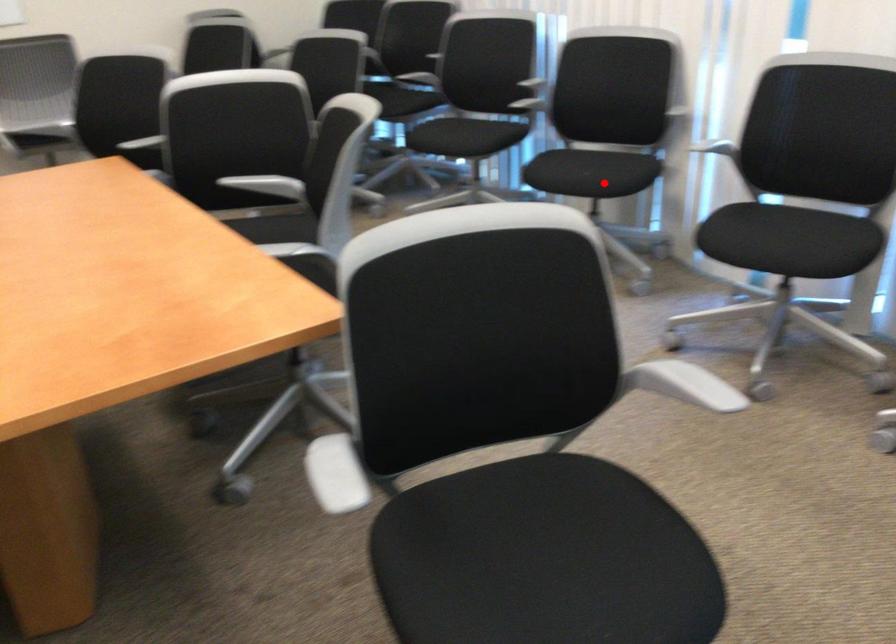
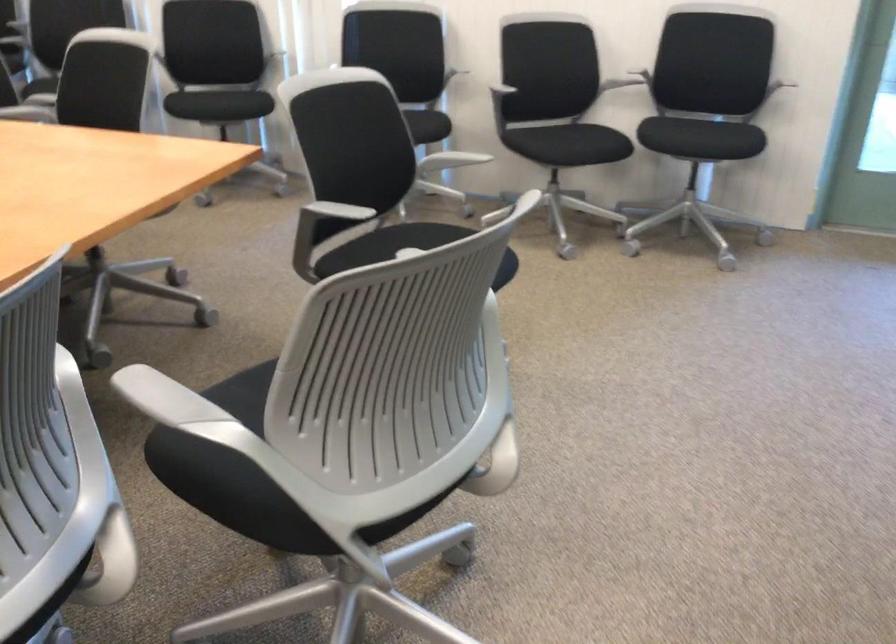
Find the pixel in the second image that matches the highlighted location in the first image.

(238, 102)